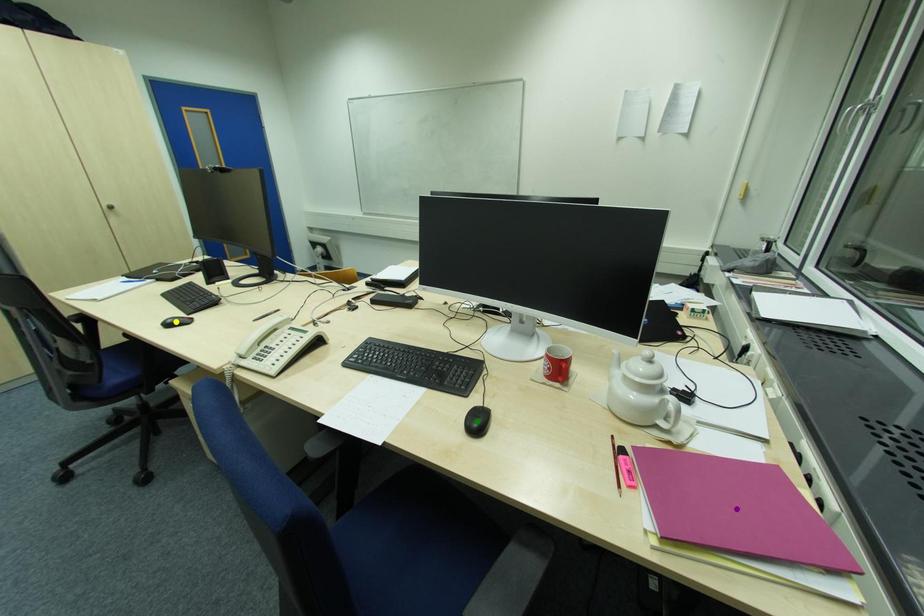
Order these from nearest to farthest:
purple point
yellow point
green point

purple point < green point < yellow point